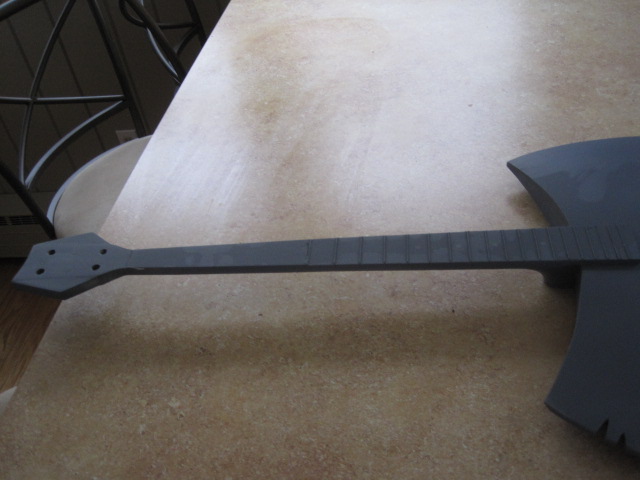
Locate an element on the screen. place to sit is located at coordinates (118, 179), (177, 48).